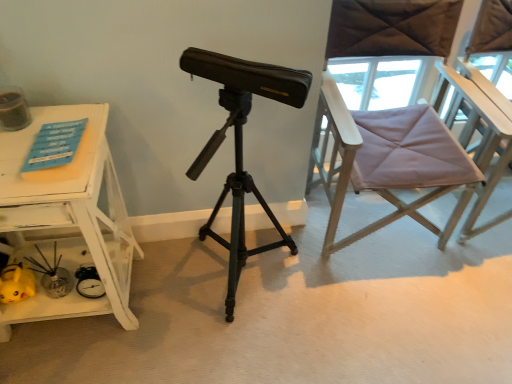
Where is `vacant region in front of purple fabric chair at right`? vacant region in front of purple fabric chair at right is located at coordinates (390, 322).